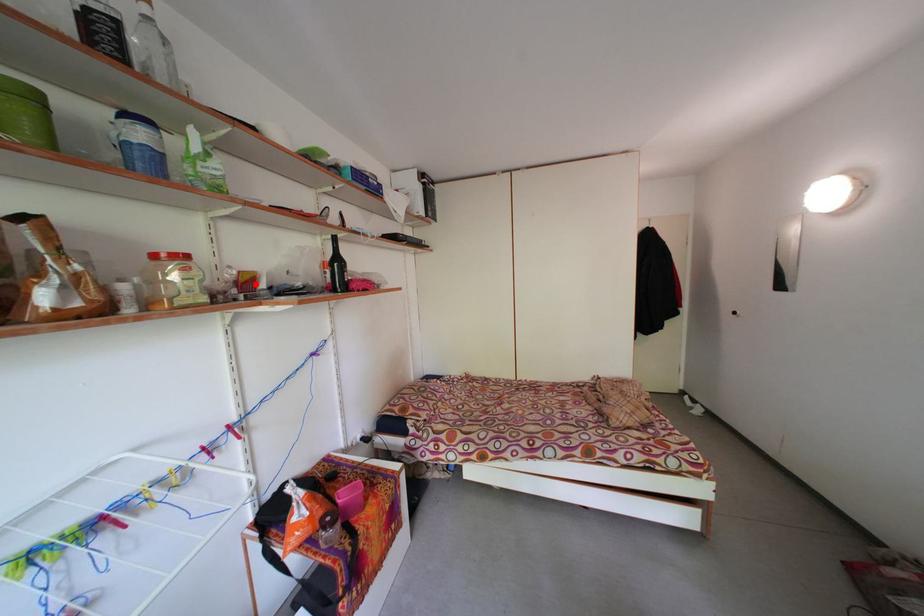
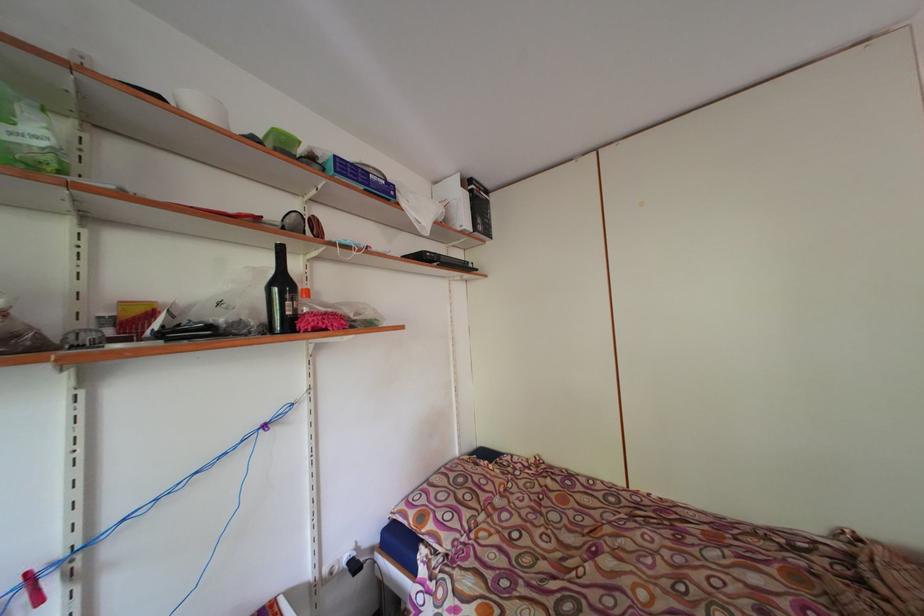
The point at the highlighted location is marked in the first image. Where is the corresponding point in the second image?

(144, 317)